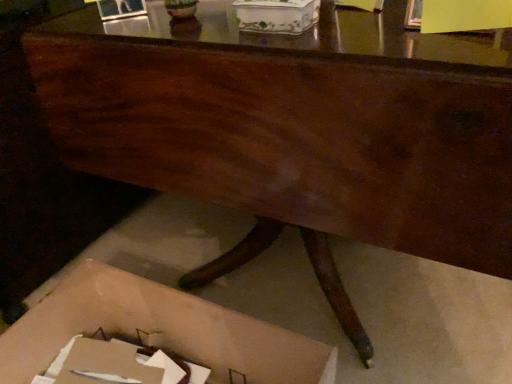
Question: Looking at their shapes, would you say cardboard box at lower center, the 2th storage box from the top, is wider or thinner than porcelain floral box at center, marked as the first storage box in a top-to-bottom arrangement?

Choices:
 (A) thin
 (B) wide

Answer: (B)

Question: Considering their positions, is cardboard box at lower center, which ranks as the first storage box in bottom-to-top order, located in front of or behind porcelain floral box at center, positioned as the second storage box in bottom-to-top order?

Choices:
 (A) behind
 (B) front

Answer: (B)

Question: From the image's perspective, is cardboard box at lower center, the 2th storage box from the top, located above or below porcelain floral box at center, positioned as the second storage box in bottom-to-top order?

Choices:
 (A) above
 (B) below

Answer: (B)

Question: Would you say porcelain floral box at center, marked as the first storage box in a top-to-bottom arrangement, is to the left or to the right of cardboard box at lower center, which ranks as the first storage box in bottom-to-top order, in the picture?

Choices:
 (A) left
 (B) right

Answer: (B)

Question: Does point tap(248, 8) appear closer or farther from the camera than point tap(115, 324)?

Choices:
 (A) farther
 (B) closer

Answer: (B)

Question: Is porcelain floral box at center, positioned as the second storage box in bottom-to-top order, spatially inside cardboard box at lower center, which ranks as the first storage box in bottom-to-top order, or outside of it?

Choices:
 (A) outside
 (B) inside

Answer: (A)

Question: From a real-world perspective, is porcelain floral box at center, marked as the first storage box in a top-to-bottom arrangement, physically located above or below cardboard box at lower center, the 2th storage box from the top?

Choices:
 (A) above
 (B) below

Answer: (A)